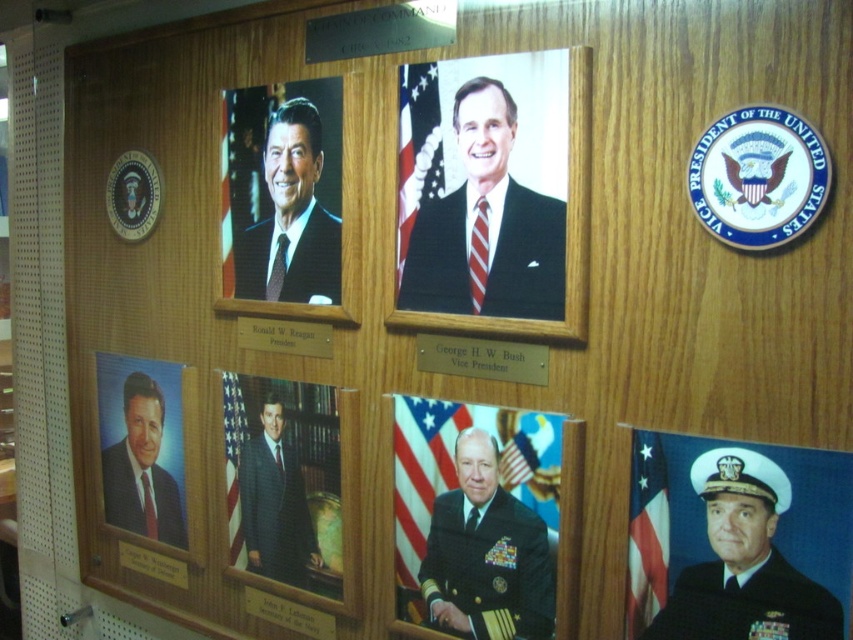
Question: Where is matte black suit at upper center located in relation to navy blue fabric at center in the image?

Choices:
 (A) left
 (B) right

Answer: (B)

Question: Among these objects, which one is farthest from the camera?

Choices:
 (A) matte black portrait at lower left
 (B) matte black suit at upper center
 (C) navy blue fabric at center

Answer: (A)

Question: Which object is the closest to the matte black suit at upper left?

Choices:
 (A) navy blue uniform at lower right
 (B) navy blue fabric at lower right
 (C) matte wood picture frame at upper left
 (D) dark blue wool suit at center

Answer: (C)

Question: Which point appears farthest from the camera in this image?

Choices:
 (A) (428, 576)
 (B) (184, 380)
 (C) (247, 506)

Answer: (B)

Question: Can you confirm if matte black portrait at center is positioned to the left of matte black portrait at lower left?

Choices:
 (A) no
 (B) yes

Answer: (A)

Question: In this image, where is shiny black uniform at center located relative to dark blue wool suit at center?

Choices:
 (A) above
 (B) below

Answer: (A)